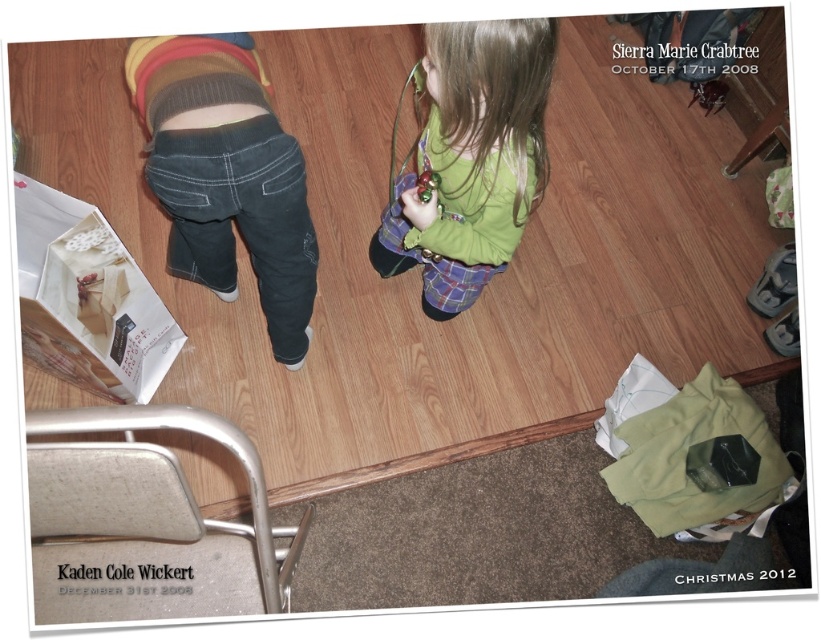
The width and height of the screenshot is (821, 640). What do you see at coordinates (226, 176) in the screenshot?
I see `denim jeans at center` at bounding box center [226, 176].

Is point (306, 321) positioned behind point (62, 330)?

Yes.

Who is more distant from viewer, (x=212, y=227) or (x=109, y=288)?

The point (x=109, y=288) is behind.

The image size is (821, 640). What are the coordinates of `denim jeans at center` in the screenshot? It's located at (226, 176).

Can you confirm if green matte shirt at center is positioned below green fabric shopping bag at lower right?

Actually, green matte shirt at center is above green fabric shopping bag at lower right.

Can you confirm if green matte shirt at center is positioned above green fabric shopping bag at lower right?

Indeed, green matte shirt at center is positioned over green fabric shopping bag at lower right.

Who is more forward, [501,209] or [659,378]?

Point [501,209]

Locate an element on the screen. The height and width of the screenshot is (640, 821). green matte shirt at center is located at coordinates (471, 157).

Who is lower down, denim jeans at center or green matte shirt at center?

denim jeans at center

Is denim jeans at center bigger than green matte shirt at center?

Indeed, denim jeans at center has a larger size compared to green matte shirt at center.

Identify the location of denim jeans at center. [226, 176].

Where is `denim jeans at center`? denim jeans at center is located at coordinates (226, 176).